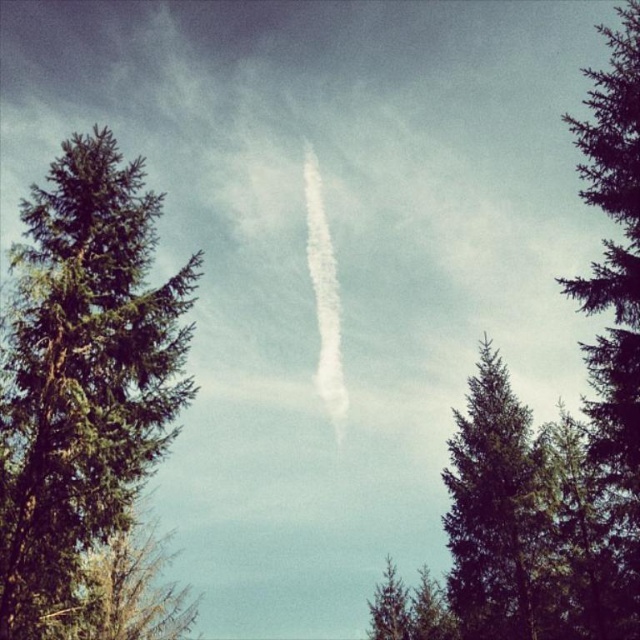
Can you confirm if green textured pine tree at center is positioned below green textured tree at center?

Incorrect, green textured pine tree at center is not positioned below green textured tree at center.

Who is lower down, green textured pine tree at center or green textured tree at center?

green textured tree at center is below.

Is point (604, 188) positioned after point (545, 561)?

That is False.

Where is `green textured pine tree at center`? This screenshot has width=640, height=640. green textured pine tree at center is located at coordinates (614, 280).

Which is in front, point (26, 285) or point (604, 106)?

Point (26, 285)

Where is `green textured tree at left`? green textured tree at left is located at coordinates (83, 376).

Who is positioned more to the right, green textured tree at left or green textured tree at center?

From the viewer's perspective, green textured tree at center appears more on the right side.

Does green textured tree at left have a smaller size compared to green textured tree at center?

No.

The width and height of the screenshot is (640, 640). What do you see at coordinates (83, 376) in the screenshot?
I see `green textured tree at left` at bounding box center [83, 376].

What are the coordinates of `green textured tree at left` in the screenshot? It's located at (83, 376).